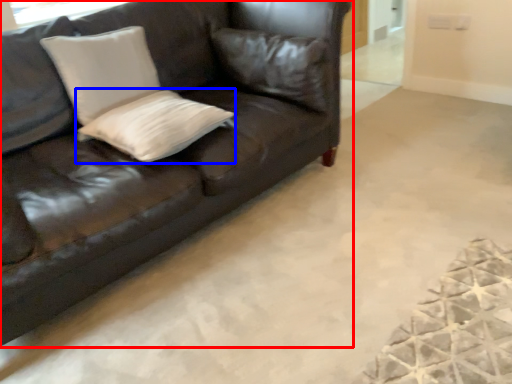
Question: Among these objects, which one is farthest to the camera, studio couch (highlighted by a red box) or pillow (highlighted by a blue box)?

Choices:
 (A) studio couch
 (B) pillow

Answer: (B)